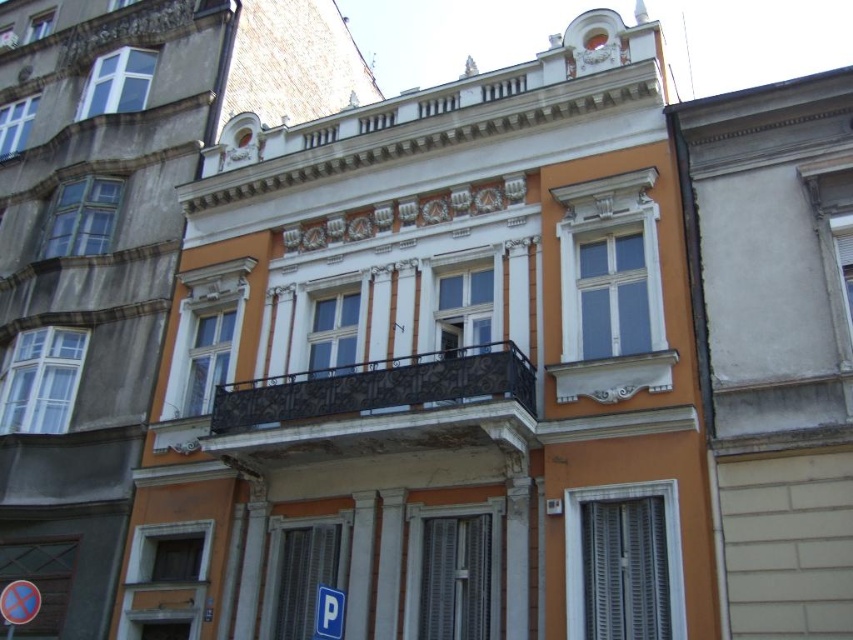
You are standing in front of the building and want to take a photo of the black wrought iron balcony at center and the blue plastic parking sign at lower center. Which object should you focus on first to ensure it appears larger in your photo?

The black wrought iron balcony at center is closer to you than the blue plastic parking sign at lower center, so focusing on it first will make it appear larger in the photo.

You are a delivery driver approaching the building and need to park near the blue plastic parking sign at lower center. As you look up, where is the black wrought iron balcony at center located relative to the parking sign?

The black wrought iron balcony at center is positioned on the right side of the blue plastic parking sign at lower center.

You are a painter who needs to choose between two items to paint next. You have the black wrought iron balcony at center and the blue plastic parking sign at lower center. Which item will require more paint due to its larger size?

The black wrought iron balcony at center requires more paint because its width is larger than the blue plastic parking sign at lower center.